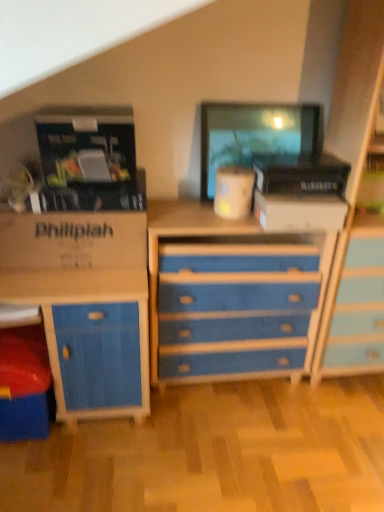
This screenshot has height=512, width=384. Describe the element at coordinates (254, 135) in the screenshot. I see `matte black monitor at upper center` at that location.

Where is `brown cardboard box at left`? This screenshot has height=512, width=384. brown cardboard box at left is located at coordinates (72, 240).

The width and height of the screenshot is (384, 512). Find the location of `matte black monitor at upper center`. matte black monitor at upper center is located at coordinates (254, 135).

In order to click on cardboard box below the white cardboard box at center (from a real-world perspective) in this screenshot , I will do `click(72, 240)`.

Does white cardboard box at center turn towards brown cardboard box at left?

No, white cardboard box at center is not turned towards brown cardboard box at left.

Looking at this image, is brown cardboard box at left a part of white cardboard box at center?

Actually, brown cardboard box at left is outside white cardboard box at center.

How different are the orientations of brown cardboard box at left and matte black monitor at upper center in degrees?

They differ by 1.03 degrees in their facing directions.

Does brown cardboard box at left appear on the left side of matte black monitor at upper center?

Indeed, brown cardboard box at left is positioned on the left side of matte black monitor at upper center.

Which point is more forward, (33,234) or (281,116)?

The point (33,234) is closer to the camera.

Is brown cardboard box at left in contact with blue painted wood chest of drawers at center?

brown cardboard box at left is not next to blue painted wood chest of drawers at center, and they're not touching.

From a real-world perspective, is brown cardboard box at left above or below blue painted wood chest of drawers at center?

brown cardboard box at left is above blue painted wood chest of drawers at center.

From the picture: Which is farther from the camera, (94,234) or (277,236)?

The point (277,236) is farther from the camera.

In terms of width, does brown cardboard box at left look wider or thinner when compared to blue painted wood chest of drawers at center?

In the image, brown cardboard box at left appears to be more narrow than blue painted wood chest of drawers at center.

Is matte black monitor at upper center located within blue painted wood chest of drawers at center?

No, matte black monitor at upper center is located outside of blue painted wood chest of drawers at center.

Can you confirm if blue painted wood chest of drawers at center is wider than matte black monitor at upper center?

Indeed, blue painted wood chest of drawers at center has a greater width compared to matte black monitor at upper center.

Between blue painted wood chest of drawers at center and matte black monitor at upper center, which one has smaller size?

Smaller between the two is matte black monitor at upper center.

Could blue painted wood chest of drawers at center be considered to be inside white cardboard box at center?

No, white cardboard box at center does not contain blue painted wood chest of drawers at center.

Does point (267, 217) come in front of point (172, 302)?

Yes, point (267, 217) is closer to viewer.

Does white cardboard box at center have a greater width compared to blue painted wood chest of drawers at center?

No, white cardboard box at center is not wider than blue painted wood chest of drawers at center.

Can you confirm if brown cardboard box at left is thinner than white cardboard box at center?

Correct, the width of brown cardboard box at left is less than that of white cardboard box at center.

In the scene shown: Considering the positions of objects brown cardboard box at left and white cardboard box at center in the image provided, who is more to the right, brown cardboard box at left or white cardboard box at center?

white cardboard box at center is more to the right.

Is brown cardboard box at left looking in the opposite direction of white cardboard box at center?

brown cardboard box at left does not have its back to white cardboard box at center.

Is brown cardboard box at left inside or outside of white cardboard box at center?

brown cardboard box at left is located beyond the bounds of white cardboard box at center.

The height and width of the screenshot is (512, 384). In the image, there is a matte black monitor at upper center. What are the coordinates of `storage box below it (from the image's perspective)` in the screenshot? It's located at (299, 212).

Is point (229, 105) positioned after point (272, 230)?

Yes, point (229, 105) is farther from viewer.

Is matte black monitor at upper center facing towards white cardboard box at center?

Yes, matte black monitor at upper center faces towards white cardboard box at center.

Based on their sizes in the image, would you say matte black monitor at upper center is bigger or smaller than white cardboard box at center?

matte black monitor at upper center is bigger than white cardboard box at center.

You are a GUI agent. You are given a task and a screenshot of the screen. Output one action in this format:
    pyautogui.click(x=<x>, y=<y>)
    Task: Click on the storage box above the brown cardboard box at left (from the image's perspective)
    
    Given the screenshot: What is the action you would take?
    pyautogui.click(x=299, y=212)

In the image, there is a matte black monitor at upper center. In order to click on cardboard box below it (from the image's perspective) in this screenshot , I will do `click(72, 240)`.

When comparing their distances from blue painted wood chest of drawers at center, does brown cardboard box at left or matte black monitor at upper center seem further?

Based on the image, matte black monitor at upper center appears to be further to blue painted wood chest of drawers at center.

Estimate the real-world distances between objects in this image. Which object is closer to matte black monitor at upper center, brown cardboard box at left or white cardboard box at center?

white cardboard box at center is closer to matte black monitor at upper center.

In the scene shown: Which object lies further to the anchor point brown cardboard box at left, matte black monitor at upper center or blue painted wood chest of drawers at center?

matte black monitor at upper center.

Based on their spatial positions, is brown cardboard box at left or matte black monitor at upper center closer to white cardboard box at center?

The object closer to white cardboard box at center is matte black monitor at upper center.

When comparing their distances from brown cardboard box at left, does matte black monitor at upper center or white cardboard box at center seem closer?

Among the two, matte black monitor at upper center is located nearer to brown cardboard box at left.

From the image, which object appears to be farther from blue painted wood chest of drawers at center, brown cardboard box at left or white cardboard box at center?

brown cardboard box at left.

Considering their positions, is white cardboard box at center positioned closer to brown cardboard box at left than matte black monitor at upper center?

Among the two, matte black monitor at upper center is located nearer to brown cardboard box at left.

Considering their positions, is blue painted wood chest of drawers at center positioned closer to matte black monitor at upper center than brown cardboard box at left?

blue painted wood chest of drawers at center is positioned closer to the anchor matte black monitor at upper center.

Where is `computer monitor between brown cardboard box at left and white cardboard box at center in the horizontal direction`? The width and height of the screenshot is (384, 512). computer monitor between brown cardboard box at left and white cardboard box at center in the horizontal direction is located at coordinates click(254, 135).

What are the coordinates of `chest of drawers between brown cardboard box at left and white cardboard box at center from left to right` in the screenshot? It's located at (231, 294).

The width and height of the screenshot is (384, 512). I want to click on the chest of drawers situated between brown cardboard box at left and matte black monitor at upper center from left to right, so click(231, 294).

Identify the location of storage box between matte black monitor at upper center and blue painted wood chest of drawers at center from top to bottom. This screenshot has width=384, height=512. (299, 212).